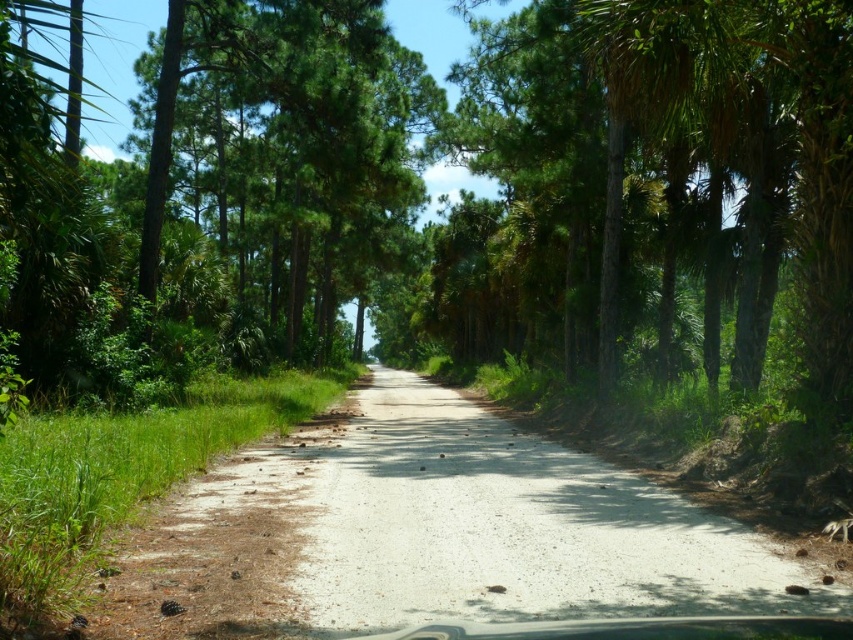
Question: Observing the image, what is the correct spatial positioning of green leafy tree at center in reference to dirt road at center?

Choices:
 (A) left
 (B) right

Answer: (A)

Question: Is green leafy tree at center closer to the viewer compared to dirt road at center?

Choices:
 (A) yes
 (B) no

Answer: (A)

Question: Can you confirm if green leafy tree at center is wider than dirt road at center?

Choices:
 (A) no
 (B) yes

Answer: (B)